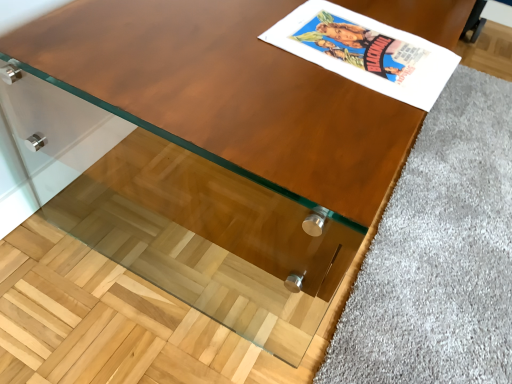
You are a GUI agent. You are given a task and a screenshot of the screen. Output one action in this format:
    pyautogui.click(x=<x>, y=<y>)
    Task: Click on the blank space situated above soft gray carpet at lower right (from a real-world perspective)
    Image resolution: width=512 pixels, height=384 pixels.
    Given the screenshot: What is the action you would take?
    pyautogui.click(x=459, y=196)